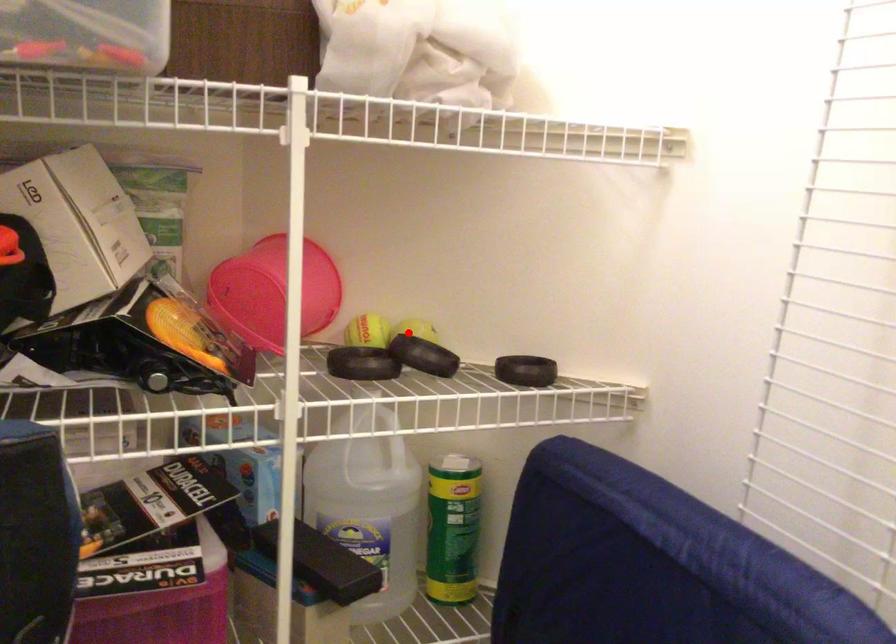
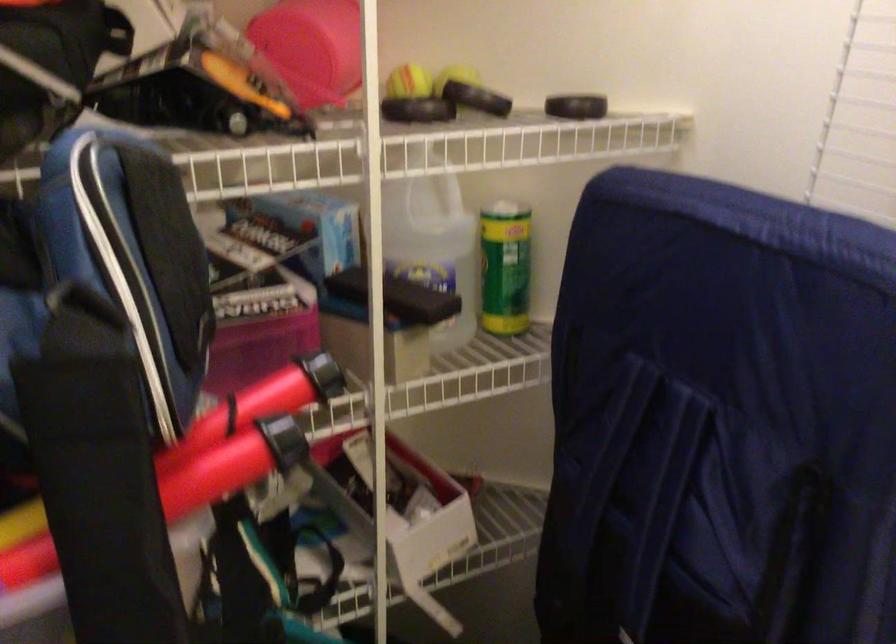
Question: I am providing you with two images of the same scene from different viewpoints. A red point is marked on the first image. Is the red point's position out of view in image 2?

Choices:
 (A) Yes
 (B) No

Answer: (B)